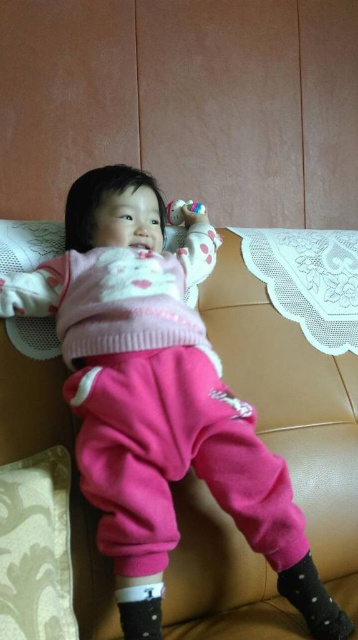
Question: Does textured cream pillow at lower left have a lesser width compared to translucent plastic toy at upper center?

Choices:
 (A) no
 (B) yes

Answer: (A)

Question: Is pink fleece sweater at upper center above textured cream pillow at lower left?

Choices:
 (A) no
 (B) yes

Answer: (B)

Question: Estimate the real-world distances between objects in this image. Which object is farther from the translucent plastic toy at upper center?

Choices:
 (A) textured cream pillow at lower left
 (B) pink fleece sweater at upper center

Answer: (A)

Question: Which point is closer to the camera taking this photo?

Choices:
 (A) (142, 316)
 (B) (170, 209)

Answer: (A)

Question: Which object appears farthest from the camera in this image?

Choices:
 (A) translucent plastic toy at upper center
 (B) pink fleece sweater at upper center

Answer: (A)

Question: Can you confirm if pink fleece sweater at upper center is bigger than textured cream pillow at lower left?

Choices:
 (A) no
 (B) yes

Answer: (B)